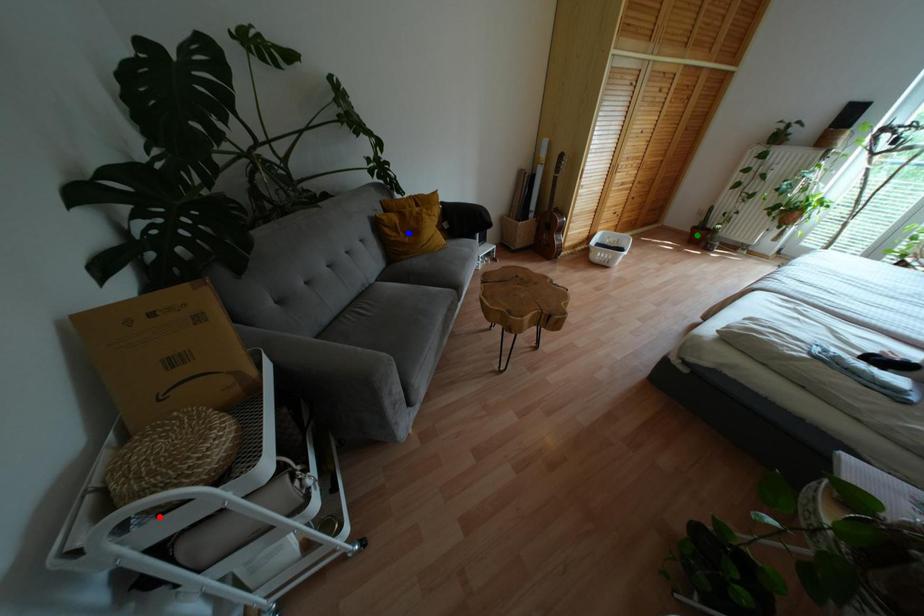
Order these from nearest to farthest:
1. red point
2. blue point
3. green point

1. red point
2. blue point
3. green point